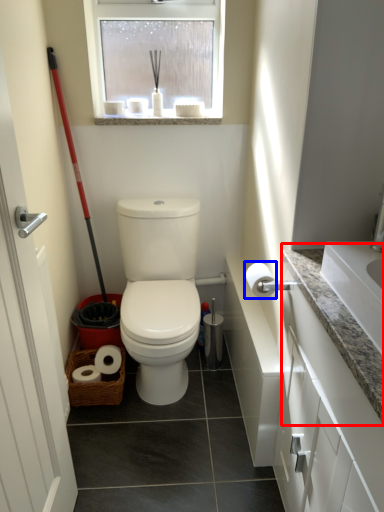
Question: Which of the following is the closest to the observer, counter top (highlighted by a red box) or toilet paper (highlighted by a blue box)?

Choices:
 (A) counter top
 (B) toilet paper

Answer: (A)